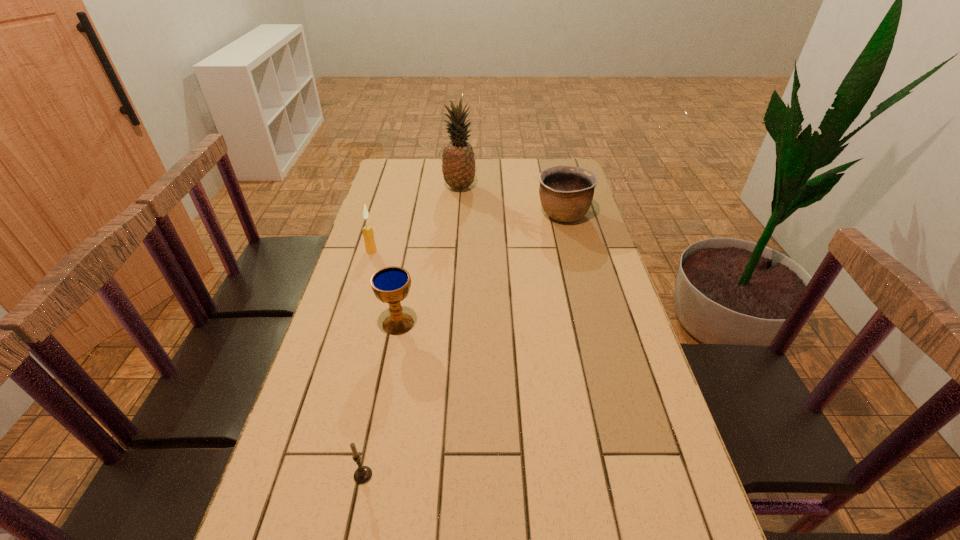
Find the location of a particular element. blank area in the image that satisfies the following two spatial constraints: 1. on the front side of the fourth nearest object; 2. on the right side of the farthest object is located at coordinates (458, 214).